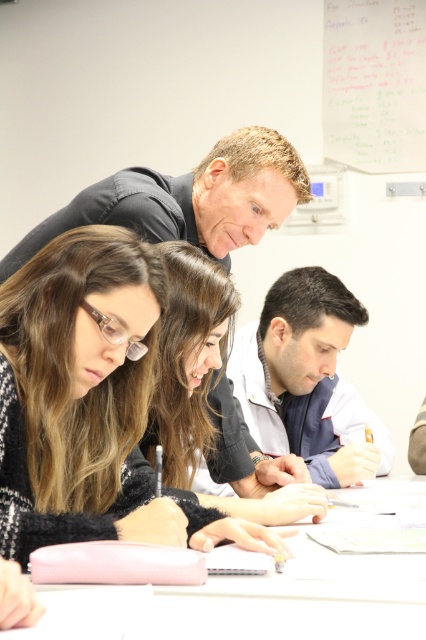
You are a photographer trying to capture a candid shot of the students in the classroom. Since you want to ensure that both the black sweater at lower left and the smooth black hair at center are visible in the frame, which object should you focus on to ensure both are in focus?

You should focus on the smooth black hair at center because it occupies more space than the black sweater at lower left, making it easier to ensure both are in focus.

You are a student trying to place a rectangular notebook between the black sweater at lower left and the smooth black hair at center on the table. Can the notebook fit horizontally between them?

The black sweater at lower left is wider than the smooth black hair at center. Therefore, the notebook can fit horizontally between them if its width is less than the distance between the two objects.

You are a student in the classroom and want to write a note on the whiteboard at upper right. You have a white fabric shirt at lower right that you can use to erase any mistakes. Considering their sizes, which object is bigger and would require more space to handle?

The white fabric shirt at lower right has a larger size compared to the whiteboard at upper right, so it requires more space to handle.